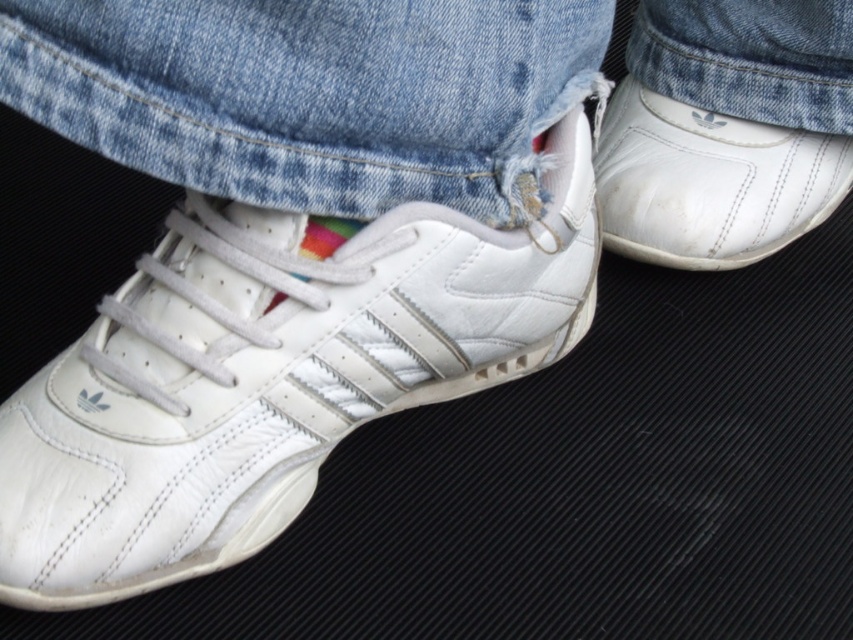
Between white leather sneaker at lower left and denim at center, which one appears on the left side from the viewer's perspective?

From the viewer's perspective, white leather sneaker at lower left appears more on the left side.

Which of these two, white leather sneaker at lower left or denim at center, stands shorter?

With less height is denim at center.

This screenshot has width=853, height=640. What do you see at coordinates (270, 374) in the screenshot?
I see `white leather sneaker at lower left` at bounding box center [270, 374].

This screenshot has width=853, height=640. Identify the location of white leather sneaker at lower left. (270, 374).

Is denim at center in front of white leather shoe at right?

Yes, denim at center is in front of white leather shoe at right.

Who is positioned more to the right, denim at center or white leather shoe at right?

white leather shoe at right

Does point (256, 92) come behind point (799, 182)?

No, it is in front of (799, 182).

Locate an element on the screen. denim at center is located at coordinates (309, 92).

Can you confirm if white leather sneaker at lower left is wider than white leather shoe at right?

Correct, the width of white leather sneaker at lower left exceeds that of white leather shoe at right.

Is point (229, 451) positioned before point (780, 232)?

Yes, point (229, 451) is closer to viewer.

What do you see at coordinates (270, 374) in the screenshot? This screenshot has width=853, height=640. I see `white leather sneaker at lower left` at bounding box center [270, 374].

Find the location of a particular element. The image size is (853, 640). white leather sneaker at lower left is located at coordinates (270, 374).